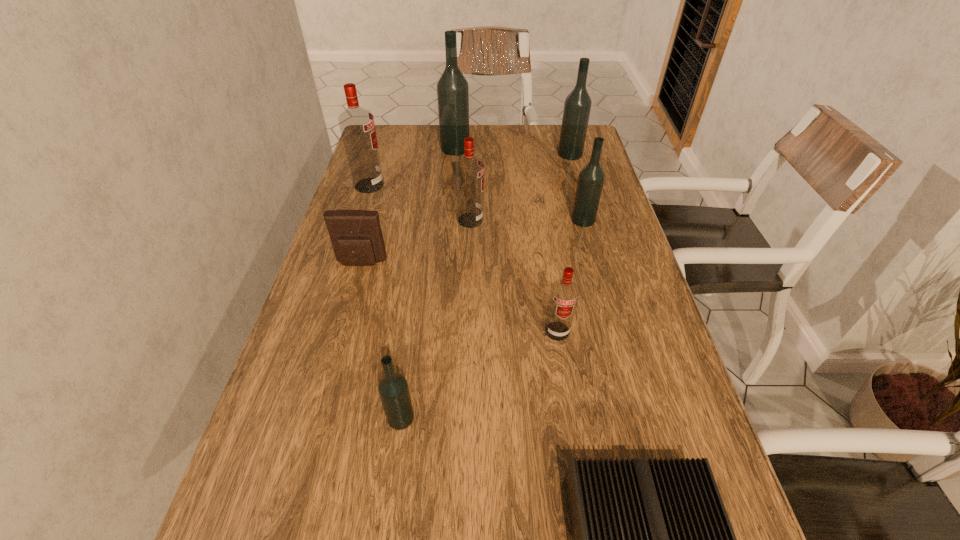
Find the location of `free space located 0.110m on the front of the second nearest object`. free space located 0.110m on the front of the second nearest object is located at coordinates (390, 496).

You are a GUI agent. You are given a task and a screenshot of the screen. Output one action in this format:
    pyautogui.click(x=<x>, y=<y>)
    Task: Click on the vacant space situated 0.180m with an open flap on the fourth nearest object
    
    Given the screenshot: What is the action you would take?
    tap(344, 329)

The height and width of the screenshot is (540, 960). I want to click on vodka located at the left edge, so click(357, 126).

Locate an element on the screen. pouch situated at the left edge is located at coordinates (356, 236).

Where is `object that is at the far right corner`? This screenshot has width=960, height=540. object that is at the far right corner is located at coordinates (577, 106).

This screenshot has height=540, width=960. I want to click on blank space at the far edge of the desktop, so click(x=524, y=138).

At what (x,y) coordinates should I click in order to perform the action: click on vacant space at the left edge. Please return your answer as a coordinate pair (x, y). The width and height of the screenshot is (960, 540). Looking at the image, I should click on (337, 338).

You are a GUI agent. You are given a task and a screenshot of the screen. Output one action in this format:
    pyautogui.click(x=<x>, y=<y>)
    Task: Click on the free region at the right edge of the desktop
    Image resolution: width=960 pixels, height=540 pixels.
    Given the screenshot: What is the action you would take?
    pyautogui.click(x=592, y=355)

Find the location of a particular element. This screenshot has width=960, height=540. free region at the far left corner is located at coordinates (414, 126).

Find the location of `empty space between the eighth tallest object and the third biggest black vodka`. empty space between the eighth tallest object and the third biggest black vodka is located at coordinates (472, 241).